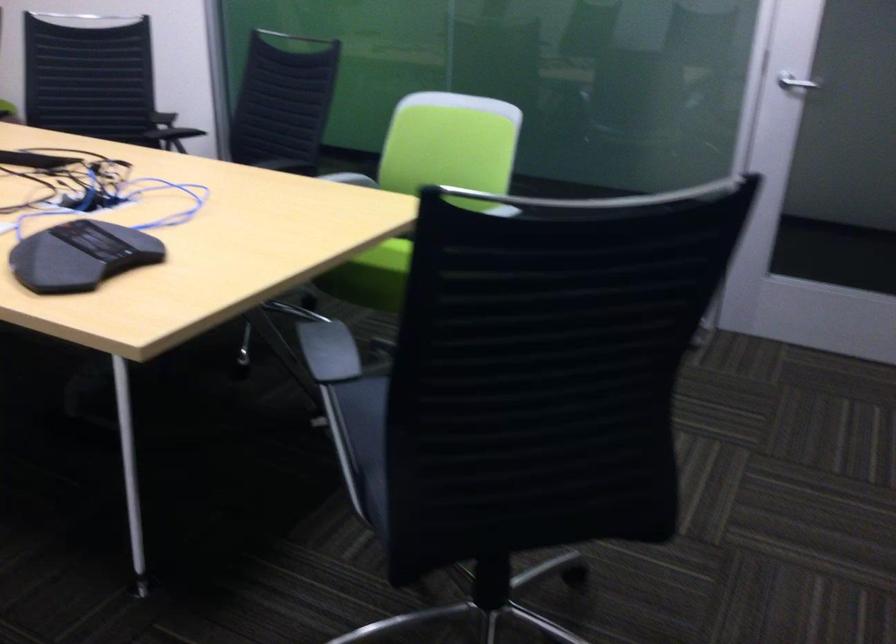
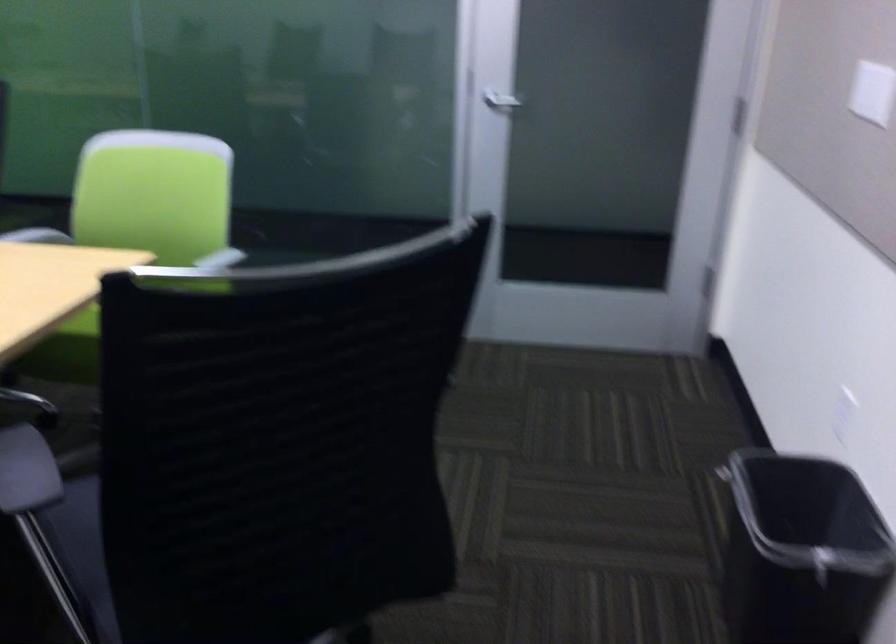
The point at [800,80] is marked in the first image. Where is the corresponding point in the second image?

(501, 102)